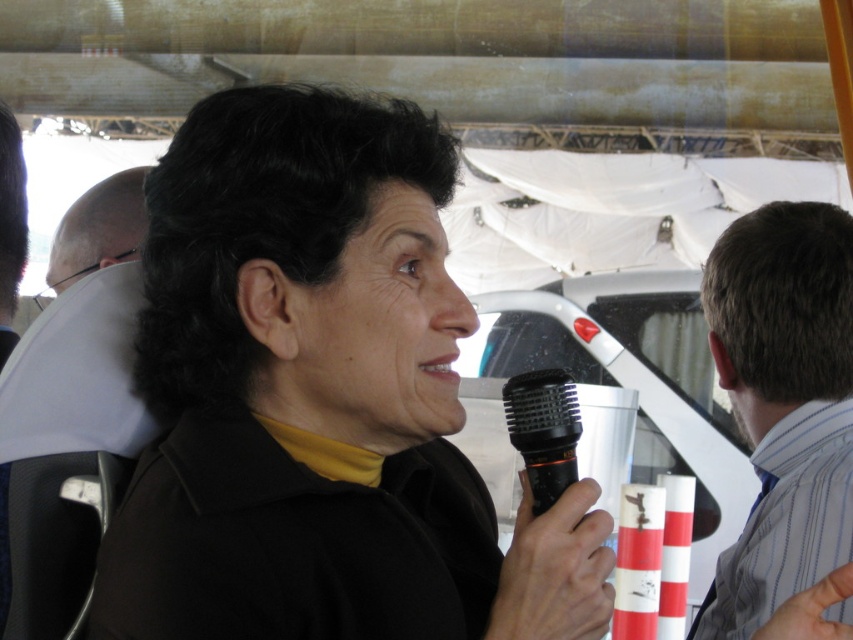
Question: Among these points, which one is nearest to the camera?

Choices:
 (A) (3, 292)
 (B) (791, 273)

Answer: (A)

Question: Can you confirm if bald head at upper left is thinner than matte black microphone at left?

Choices:
 (A) no
 (B) yes

Answer: (A)

Question: Can you confirm if gray striped shirt at right is thinner than bald head at upper left?

Choices:
 (A) yes
 (B) no

Answer: (A)

Question: Where is black matte shirt at center located in relation to matte black microphone at left in the image?

Choices:
 (A) right
 (B) left

Answer: (A)

Question: Which object is the closest to the gray striped shirt at right?

Choices:
 (A) matte black microphone at left
 (B) black matte microphone at center
 (C) bald head at upper left

Answer: (B)

Question: Which of these objects is positioned farthest from the matte black microphone at left?

Choices:
 (A) black matte shirt at center
 (B) gray striped shirt at right
 (C) bald head at upper left

Answer: (C)